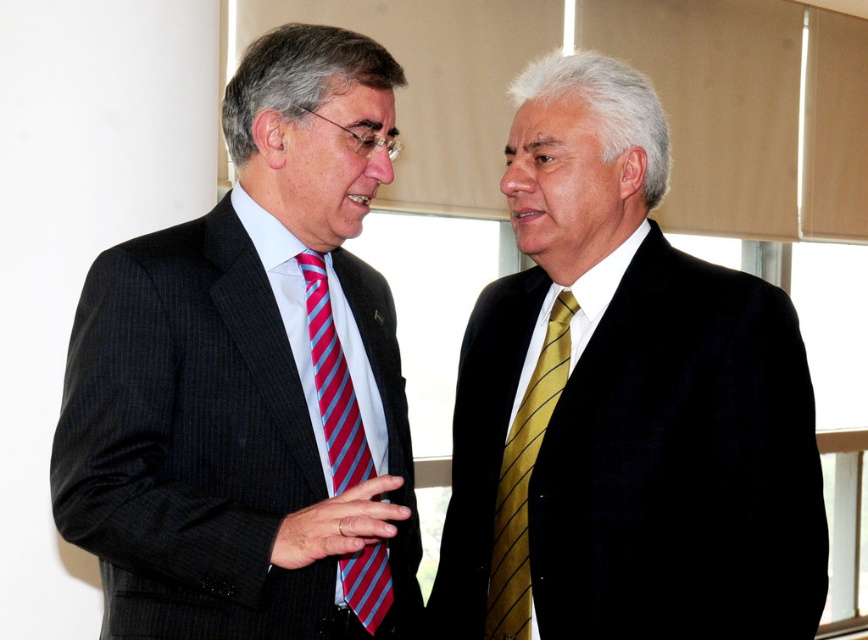
Does gold striped tie at right have a greater height compared to striped silk tie at left?

Incorrect, gold striped tie at right's height is not larger of striped silk tie at left's.

Is gold striped tie at right smaller than striped silk tie at left?

Incorrect, gold striped tie at right is not smaller in size than striped silk tie at left.

What are the coordinates of `gold striped tie at right` in the screenshot? It's located at (524, 481).

Where is `gold striped tie at right`? The width and height of the screenshot is (868, 640). gold striped tie at right is located at coordinates (524, 481).

Who is more distant from viewer, (95, 348) or (304, 272)?

The point (304, 272) is more distant.

Who is lower down, matte black suit at left or striped silk tie at left?

striped silk tie at left is lower down.

You are a GUI agent. You are given a task and a screenshot of the screen. Output one action in this format:
    pyautogui.click(x=<x>, y=<y>)
    Task: Click on the matte black suit at left
    The width and height of the screenshot is (868, 640).
    Given the screenshot: What is the action you would take?
    pyautogui.click(x=251, y=380)

Is point (560, 488) farther from camera compared to point (316, 356)?

No, (560, 488) is in front of (316, 356).

Based on the photo, can you confirm if matte black suit at right is thinner than striped silk tie at left?

Incorrect, matte black suit at right's width is not less than striped silk tie at left's.

Describe the element at coordinates (623, 404) in the screenshot. This screenshot has height=640, width=868. I see `matte black suit at right` at that location.

At what (x,y) coordinates should I click in order to perform the action: click on matte black suit at right. Please return your answer as a coordinate pair (x, y). Looking at the image, I should click on (623, 404).